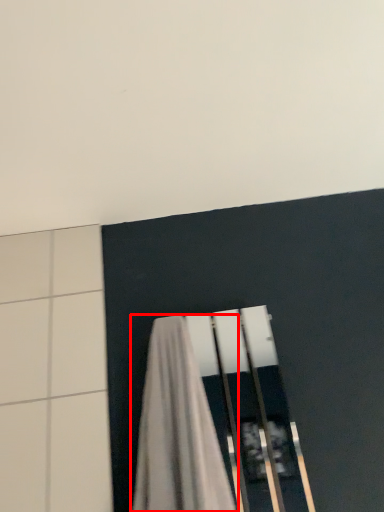
Question: In this image, where is curtain (annotated by the red box) located relative to backdrop?

Choices:
 (A) left
 (B) right

Answer: (A)